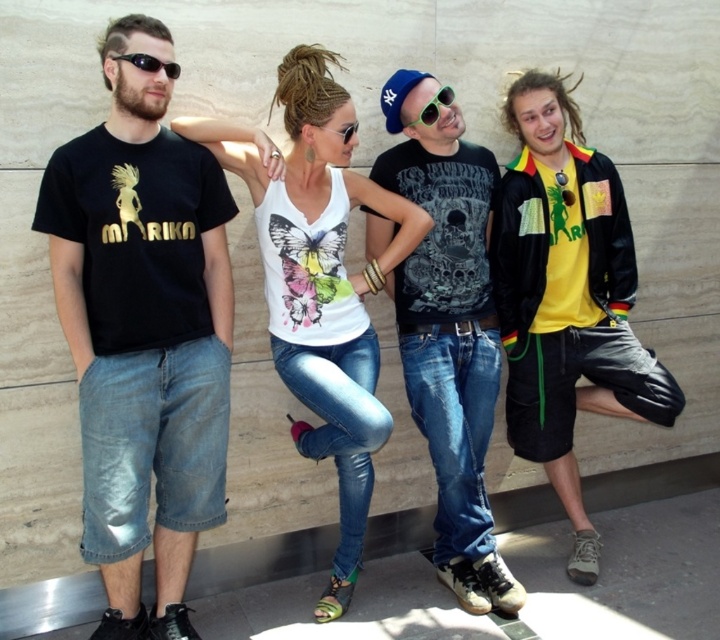
You are standing in front of the group of four people against the light beige stone wall. There is a point at coordinates point (x=216, y=504). Can you reach that point without moving closer to the group?

The distance between point (x=216, y=504) and the viewer is 8.54 feet, so you would need to move closer to reach it since it is 8.54 feet away.